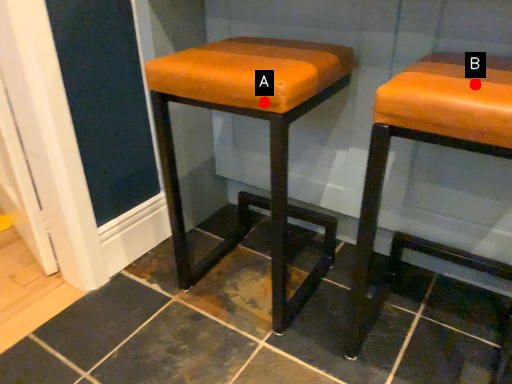
Question: Two points are circled on the image, labeled by A and B beside each circle. Which point is further to the camera?

Choices:
 (A) A is further
 (B) B is further

Answer: (A)